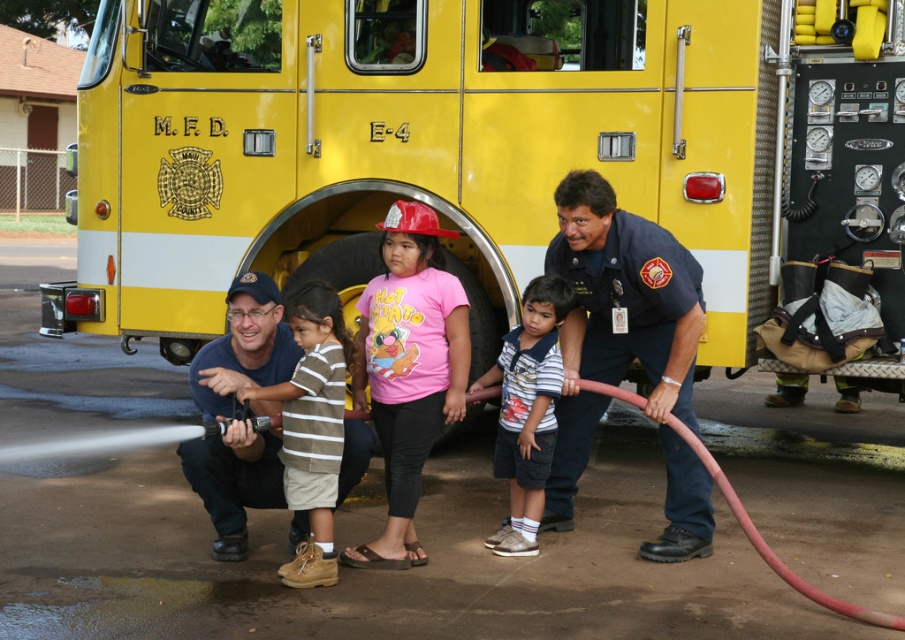
Describe the element at coordinates (475, 147) in the screenshot. I see `yellow matte fire truck at center` at that location.

Is point (541, 236) positioned after point (354, 374)?

Yes, point (541, 236) is behind point (354, 374).

This screenshot has height=640, width=905. Find the location of `yellow matte fire truck at center`. yellow matte fire truck at center is located at coordinates (475, 147).

Is pink cotton shirt at center positioned in front of rubber/matte fire hose at lower center?

No, pink cotton shirt at center is behind rubber/matte fire hose at lower center.

Where is `pink cotton shirt at center`? Image resolution: width=905 pixels, height=640 pixels. pink cotton shirt at center is located at coordinates (408, 369).

Does dark blue uniform at center have a lesser height compared to striped cotton shirt at center?

Result: No.

Is dark blue uniform at center to the right of striped cotton shirt at center from the viewer's perspective?

Indeed, dark blue uniform at center is positioned on the right side of striped cotton shirt at center.

Describe the element at coordinates (626, 349) in the screenshot. The image size is (905, 640). I see `dark blue uniform at center` at that location.

I want to click on dark blue uniform at center, so click(x=626, y=349).